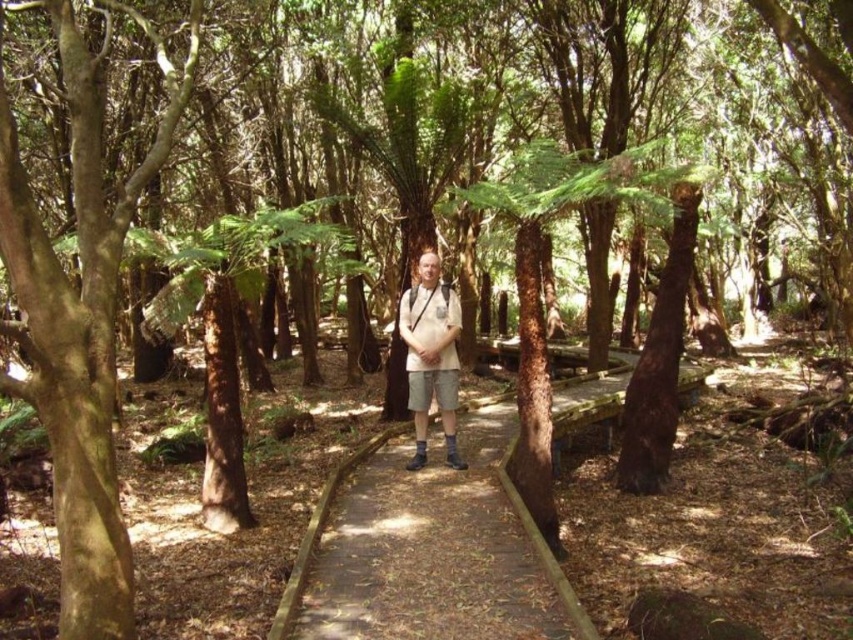
You are standing on the wooden boardwalk at center and want to take a photo of the brown rough bark tree at left. In which direction should you point your camera?

You should point your camera to the left because the brown rough bark tree at left is located to the left of the wooden boardwalk at center.

You are a hiker wearing a white cotton shirt at center and want to take a photo of yourself next to the brown rough bark tree at left. Will the tree appear wider than your shirt in the photo?

The brown rough bark tree at left might be wider than the white cotton shirt at center, so it is possible that the tree will appear wider in the photo.